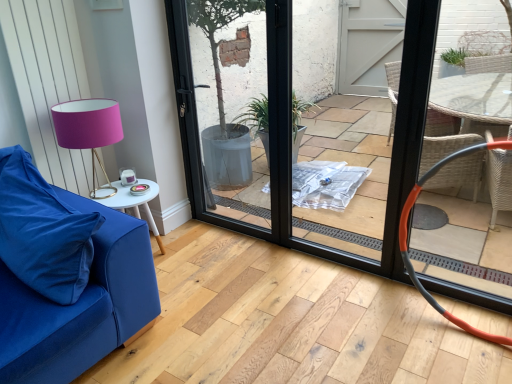
Question: Is black glass door at center at the right side of white glossy side table at lower left?

Choices:
 (A) yes
 (B) no

Answer: (A)

Question: Considering the relative sizes of black glass door at center and white glossy side table at lower left in the image provided, is black glass door at center shorter than white glossy side table at lower left?

Choices:
 (A) yes
 (B) no

Answer: (B)

Question: Is black glass door at center oriented away from white glossy side table at lower left?

Choices:
 (A) no
 (B) yes

Answer: (A)

Question: From the image's perspective, is black glass door at center on white glossy side table at lower left?

Choices:
 (A) yes
 (B) no

Answer: (A)

Question: Is black glass door at center wider than white glossy side table at lower left?

Choices:
 (A) no
 (B) yes

Answer: (A)

Question: From a real-world perspective, is black glass door at center below white glossy side table at lower left?

Choices:
 (A) no
 (B) yes

Answer: (A)

Question: Is matte gold table lamp at left bigger than white glossy side table at lower left?

Choices:
 (A) yes
 (B) no

Answer: (A)

Question: Considering the relative sizes of matte gold table lamp at left and white glossy side table at lower left in the image provided, is matte gold table lamp at left smaller than white glossy side table at lower left?

Choices:
 (A) no
 (B) yes

Answer: (A)

Question: From a real-world perspective, is matte gold table lamp at left located higher than white glossy side table at lower left?

Choices:
 (A) yes
 (B) no

Answer: (A)

Question: Would you consider matte gold table lamp at left to be distant from white glossy side table at lower left?

Choices:
 (A) no
 (B) yes

Answer: (A)

Question: Does matte gold table lamp at left lie in front of white glossy side table at lower left?

Choices:
 (A) yes
 (B) no

Answer: (A)

Question: Is matte gold table lamp at left at the right side of white glossy side table at lower left?

Choices:
 (A) no
 (B) yes

Answer: (A)

Question: From a real-world perspective, is black glass door at center located higher than velvety blue pillow at lower left?

Choices:
 (A) yes
 (B) no

Answer: (A)